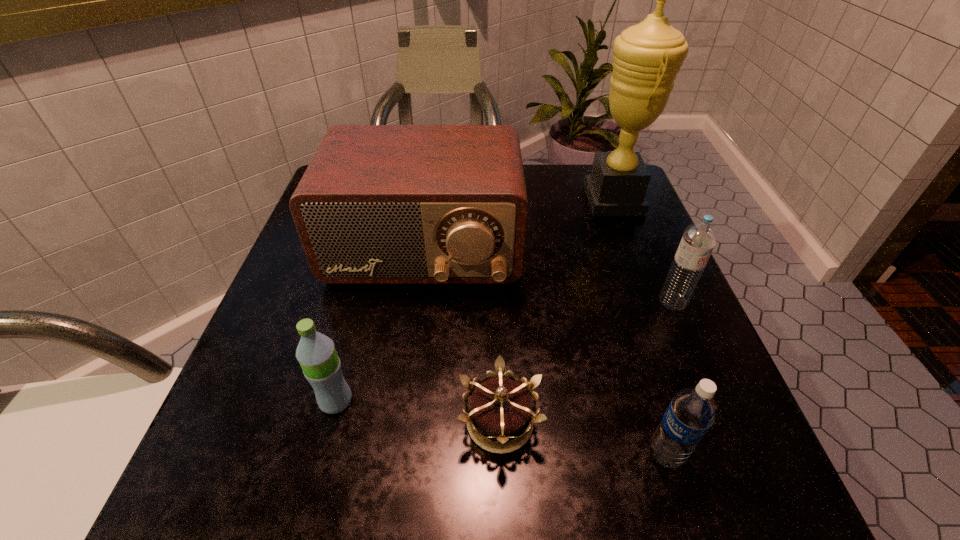
This screenshot has height=540, width=960. I want to click on free space between the shortest object and the second water bottle from right to left, so click(583, 438).

Where is `vacant area that lies between the nearest water bottle and the crown`? The width and height of the screenshot is (960, 540). vacant area that lies between the nearest water bottle and the crown is located at coordinates (583, 438).

Find the location of a particular element. vacant area between the second nearest water bottle and the tallest object is located at coordinates (474, 300).

What are the coordinates of `empty space that is in between the nearest water bottle and the crown` in the screenshot? It's located at (583, 438).

This screenshot has height=540, width=960. Identify the location of free space between the radio receiver and the shortest object. (462, 336).

What are the coordinates of `vacant region between the trophy cup and the leftmost water bottle` in the screenshot? It's located at (474, 300).

The height and width of the screenshot is (540, 960). Find the location of `unoccupied area between the second nearest water bottle and the shortest object`. unoccupied area between the second nearest water bottle and the shortest object is located at coordinates (418, 411).

The image size is (960, 540). What are the coordinates of `vacant point located between the farthest water bottle and the crown` in the screenshot? It's located at (587, 362).

The height and width of the screenshot is (540, 960). Identify the location of the fifth closest object to the nearest water bottle. (647, 57).

Find the location of a particular element. the second closest object to the farthest water bottle is located at coordinates (693, 410).